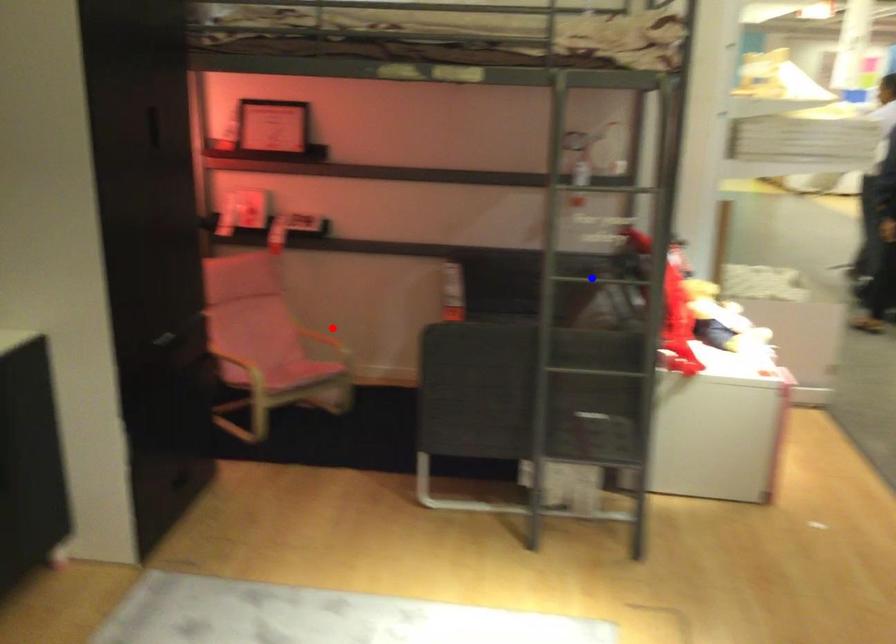
Question: Two points are marked on the image. Which point is closer to the camera?

Choices:
 (A) Blue point is closer.
 (B) Red point is closer.

Answer: (A)